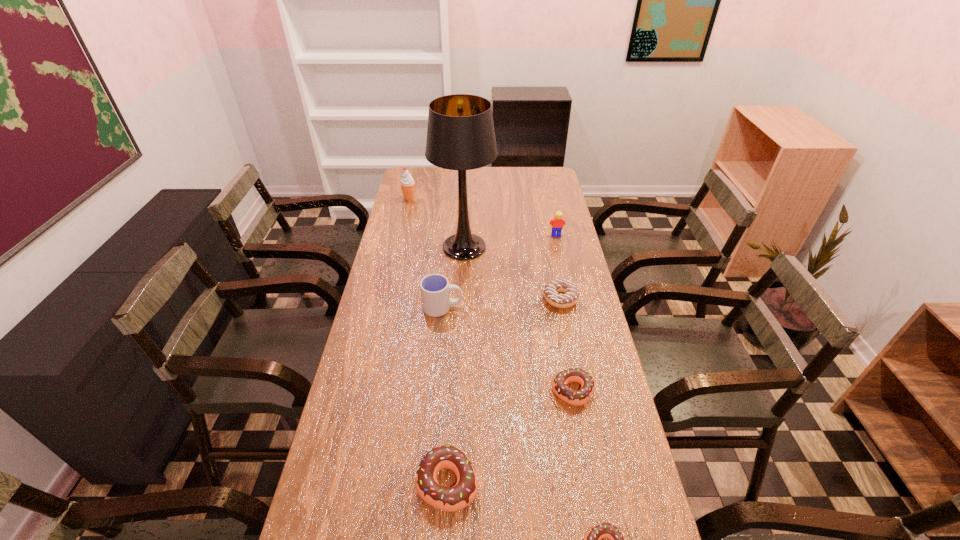
Image resolution: width=960 pixels, height=540 pixels. What are the coordinates of `doughnut that stands as the second closest to the cup` in the screenshot? It's located at (569, 395).

Where is `doughnut that can be found as the fourth closest to the cup`? doughnut that can be found as the fourth closest to the cup is located at coordinates (593, 538).

Locate which brown doughnut is the third closest to the tallest object. Please provide its 2D coordinates. Your answer should be formatted as a tuple, i.e. [(x, y)], where the tuple contains the x and y coordinates of a point satisfying the conditions above.

[(593, 538)]

Find the location of a particular element. brown doughnut that is the third nearest to the leftmost object is located at coordinates (593, 538).

Find the location of a particular element. free space that satisfies the following two spatial constraints: 1. on the front-facing side of the Lego; 2. with the handle on the side of the cup is located at coordinates (572, 307).

Identify the location of vacant area that satisfies the following two spatial constraints: 1. with the handle on the side of the third farthest doughnut; 2. on the right side of the cup. The width and height of the screenshot is (960, 540). (427, 482).